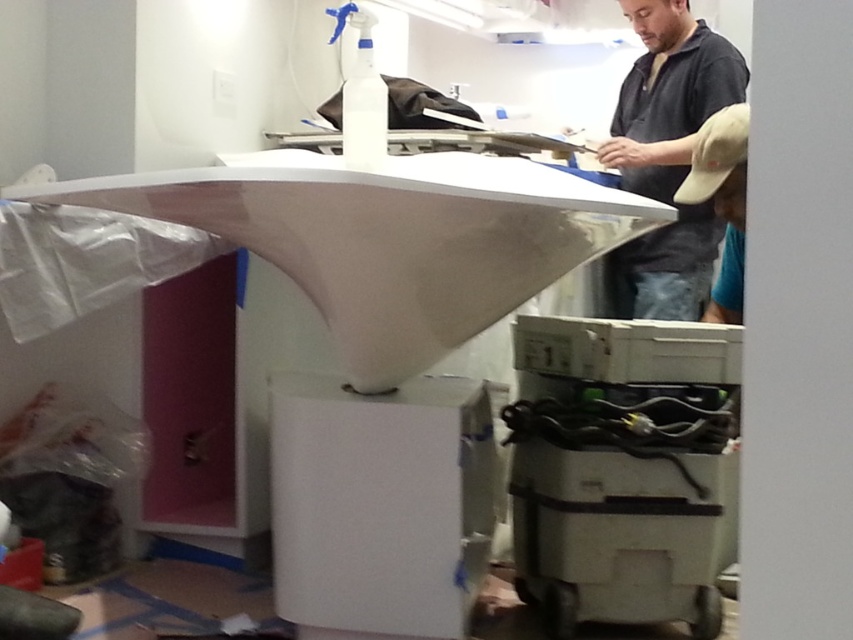
Image resolution: width=853 pixels, height=640 pixels. What do you see at coordinates (387, 237) in the screenshot?
I see `white glossy exhaust hood at center` at bounding box center [387, 237].

Is point (428, 198) behind point (544, 528)?

No, it is in front of (544, 528).

Which is behind, point (390, 237) or point (697, 404)?

Point (697, 404)

The image size is (853, 640). What are the coordinates of `white glossy exhaust hood at center` in the screenshot? It's located at (387, 237).

Who is positioned more to the left, white plastic printer at lower right or matte black shirt at upper center?

white plastic printer at lower right is more to the left.

Does white plastic printer at lower right have a larger size compared to matte black shirt at upper center?

No.

Where is `white plastic printer at lower right`? Image resolution: width=853 pixels, height=640 pixels. white plastic printer at lower right is located at coordinates (624, 468).

Based on the photo, does matte black shirt at upper center appear over khaki fabric cap at right?

Indeed, matte black shirt at upper center is positioned over khaki fabric cap at right.

Where is `matte black shirt at upper center`? The width and height of the screenshot is (853, 640). matte black shirt at upper center is located at coordinates (668, 96).

Image resolution: width=853 pixels, height=640 pixels. Describe the element at coordinates (668, 96) in the screenshot. I see `matte black shirt at upper center` at that location.

Locate an element on the screen. matte black shirt at upper center is located at coordinates tap(668, 96).